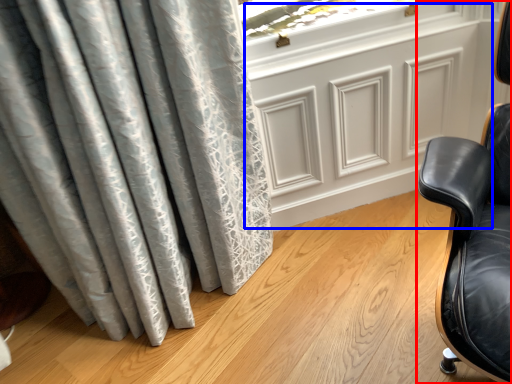
Question: Which point is closer to the camera, chair (highlighted by a red box) or screen door (highlighted by a blue box)?

Choices:
 (A) chair
 (B) screen door

Answer: (A)